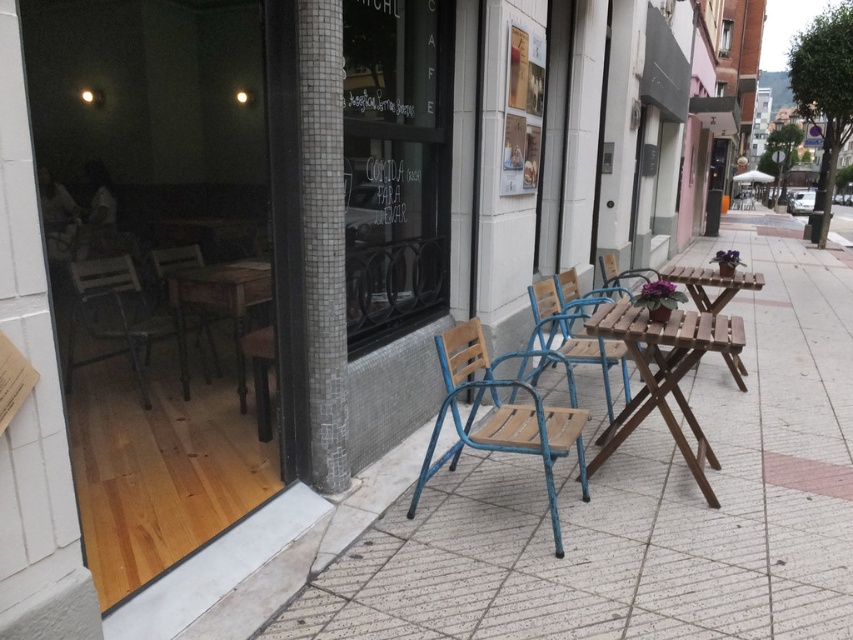
Question: Estimate the real-world distances between objects in this image. Which object is farther from the wooden picnic table at center?

Choices:
 (A) wooden chair at center
 (B) wooden table at left
 (C) wooden pavement at center

Answer: (B)

Question: Where is wooden chair at left located in relation to wooden picnic table at center in the image?

Choices:
 (A) below
 (B) above

Answer: (A)

Question: Which point is closer to the camera?

Choices:
 (A) wooden table at left
 (B) blue metal chair at center
 (C) wooden picnic table at center
 (D) brown wooden table at center

Answer: (B)

Question: Estimate the real-world distances between objects in this image. Which object is farther from the metallic brown chair at left?

Choices:
 (A) blue metal chair at center
 (B) brown wooden table at center
 (C) wooden pavement at center
 (D) wooden table at left

Answer: (C)

Question: Can you confirm if wooden chair at left is positioned above metallic brown chair at left?

Choices:
 (A) yes
 (B) no

Answer: (B)

Question: Does brown wooden table at center appear on the left side of wooden table at left?

Choices:
 (A) no
 (B) yes

Answer: (A)